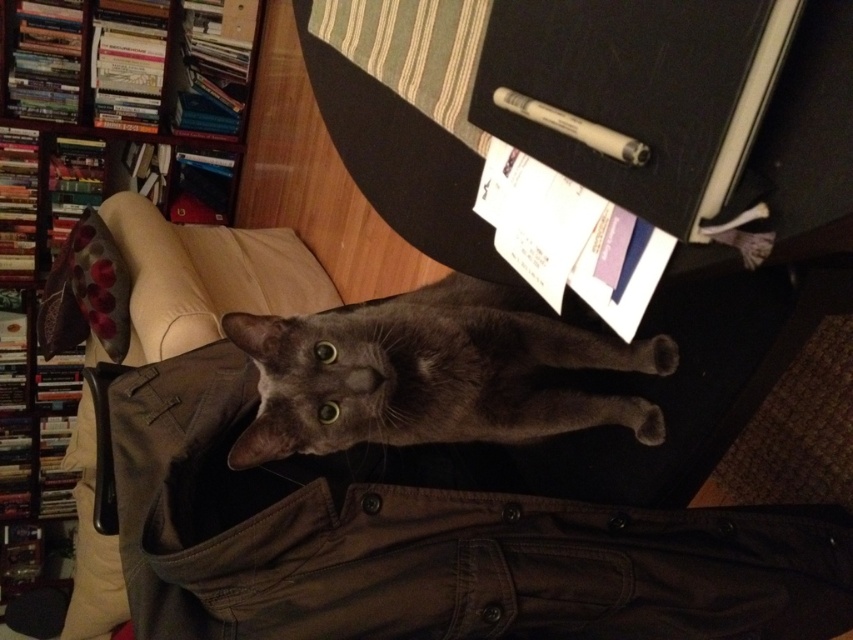
You are a photographer standing at a certain distance from the shiny gray cat at center. You want to take a closeup photo of the cat. The camera requires the subject to be within 24 inches for optimal focus. Can you take the photo without moving closer?

The distance between the shiny gray cat at center and the camera is 30.48 inches, which is beyond the 24 inches required for optimal focus. Therefore, you need to move closer to take the closeup photo.

You are organizing a photo shoot and need to ensure the shiny gray cat at center is visible in the final image. Given that the wooden bookshelf at upper left is part of the background, will the cat be obscured by the bookshelf?

The shiny gray cat at center is in front of the wooden bookshelf at upper left, so it will not be obscured by the bookshelf and will remain visible in the photo shoot.

You are organizing a photo shoot for a cat and need to ensure the cat fits within the frame. Given the scene described, can the shiny gray cat at center be positioned to fit entirely within the wooden bookshelf at upper left in the background?

The shiny gray cat at center has a width less than the wooden bookshelf at upper left, so yes, the cat can be positioned to fit entirely within the wooden bookshelf at upper left.